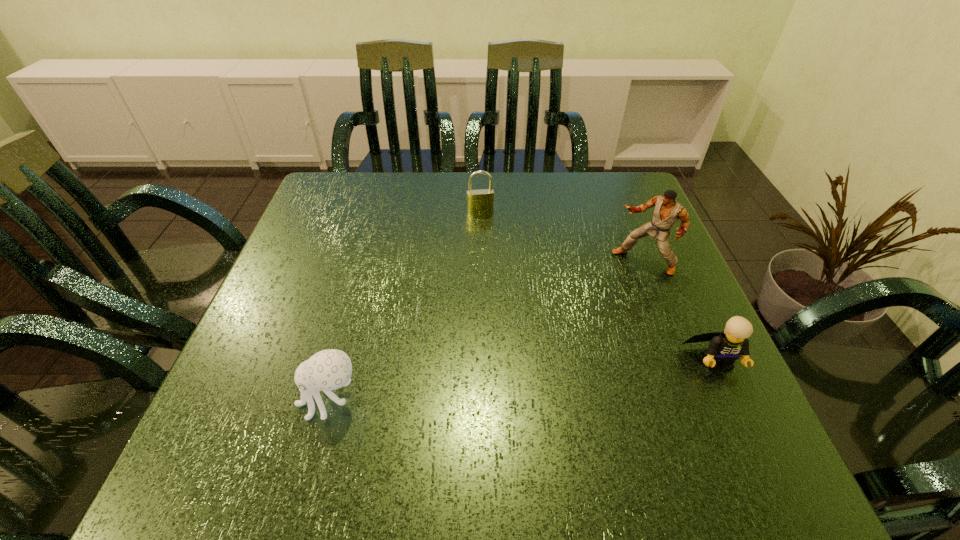
Where is `free area in between the Lego and the tallest object`? This screenshot has height=540, width=960. free area in between the Lego and the tallest object is located at coordinates (680, 312).

Locate an element on the screen. This screenshot has width=960, height=540. empty space that is in between the second farthest object and the Lego is located at coordinates (x=680, y=312).

The height and width of the screenshot is (540, 960). In order to click on unoccupied position between the octopus and the second object from left to right in this screenshot , I will do `click(405, 305)`.

Find the location of a particular element. Image resolution: width=960 pixels, height=540 pixels. unoccupied position between the Lego and the padlock is located at coordinates (598, 286).

Locate an element on the screen. The width and height of the screenshot is (960, 540). free spot between the Lego and the leftmost object is located at coordinates (523, 380).

Find the location of a particular element. free space between the puncher and the farthest object is located at coordinates (562, 237).

Find the location of a particular element. The image size is (960, 540). free point between the tallest object and the Lego is located at coordinates (680, 312).

Image resolution: width=960 pixels, height=540 pixels. Identify the location of free space that is in between the leftmost object and the puncher. pyautogui.click(x=487, y=331).

Where is `object that is the second closest one to the Lego`? This screenshot has width=960, height=540. object that is the second closest one to the Lego is located at coordinates (478, 201).

In order to click on object that stands as the closest to the Lego in this screenshot , I will do `click(667, 211)`.